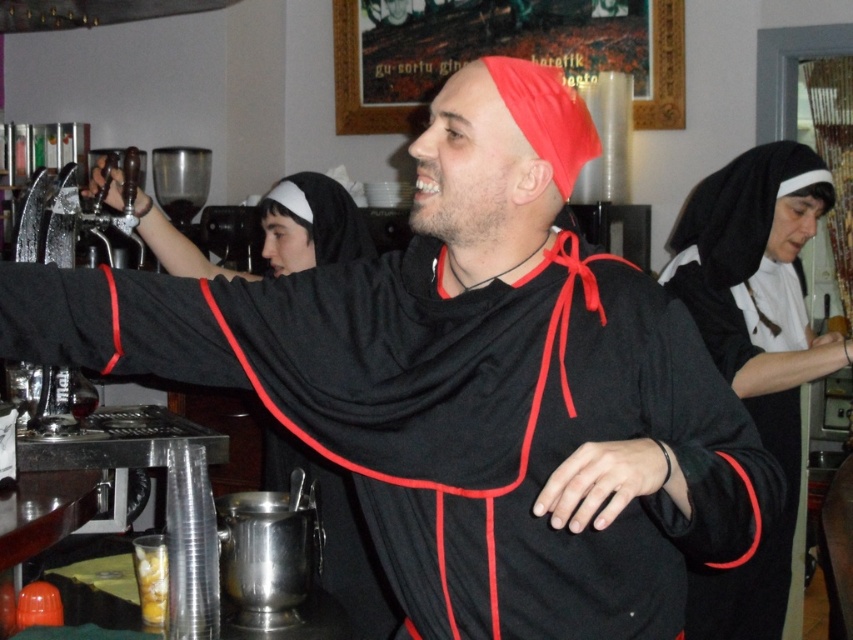
Question: Can you confirm if black velvet habit at upper right is thinner than translucent plastic cup at lower left?

Choices:
 (A) yes
 (B) no

Answer: (B)

Question: Among these points, which one is farthest from the camera?

Choices:
 (A) (149, 580)
 (B) (773, 333)

Answer: (B)

Question: Does black velvet habit at upper right appear on the right side of translucent plastic cup at lower left?

Choices:
 (A) yes
 (B) no

Answer: (A)

Question: Which object appears closest to the camera in this image?

Choices:
 (A) black velvet habit at upper right
 (B) translucent plastic cup at lower left

Answer: (B)

Question: Can you confirm if black velvet habit at upper right is positioned above translucent plastic cup at lower left?

Choices:
 (A) yes
 (B) no

Answer: (A)